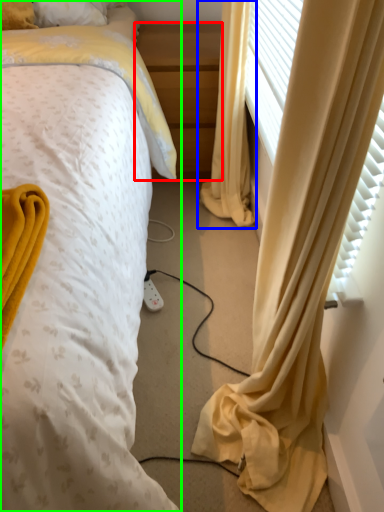
Question: Estimate the real-world distances between objects in this image. Which object is farther from nightstand (highlighted by a red box), curtain (highlighted by a blue box) or bed (highlighted by a green box)?

Choices:
 (A) curtain
 (B) bed

Answer: (B)